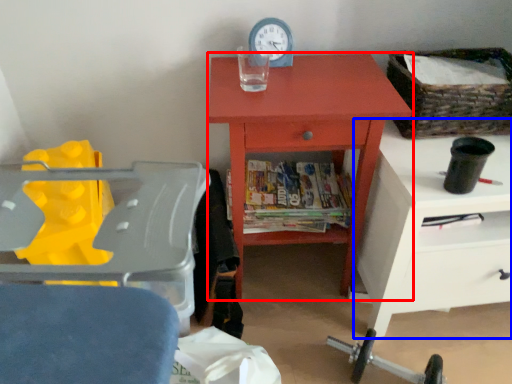
Question: Which object is closer to the camera taking this photo, chest of drawers (highlighted by a red box) or nightstand (highlighted by a blue box)?

Choices:
 (A) chest of drawers
 (B) nightstand

Answer: (B)